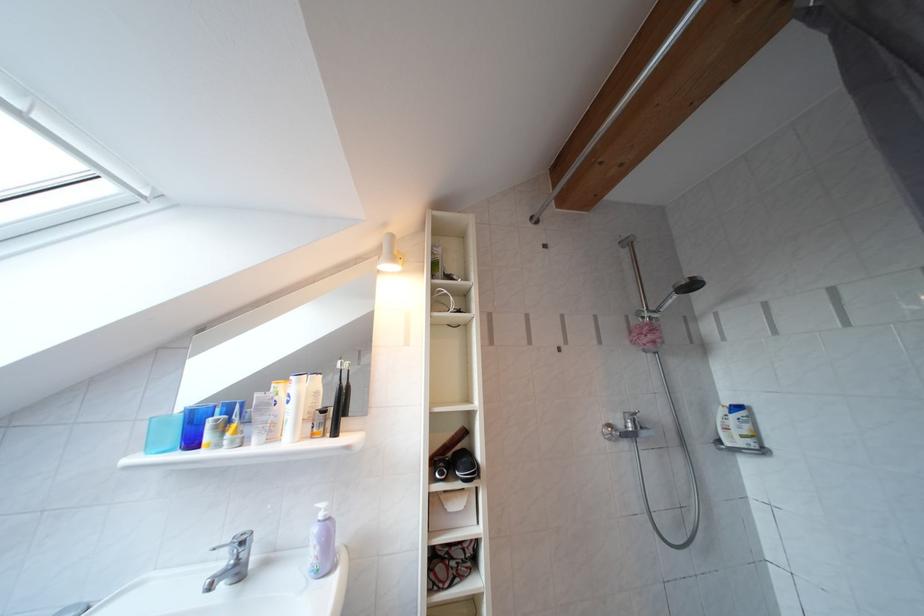
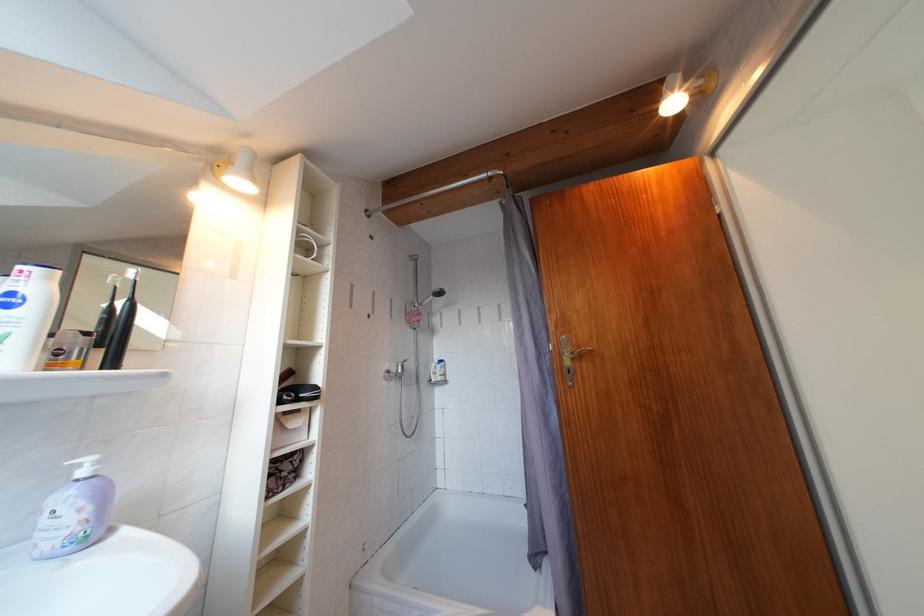
In the second image, find the point that corresponds to the point at 636,347 in the first image.

(411, 325)